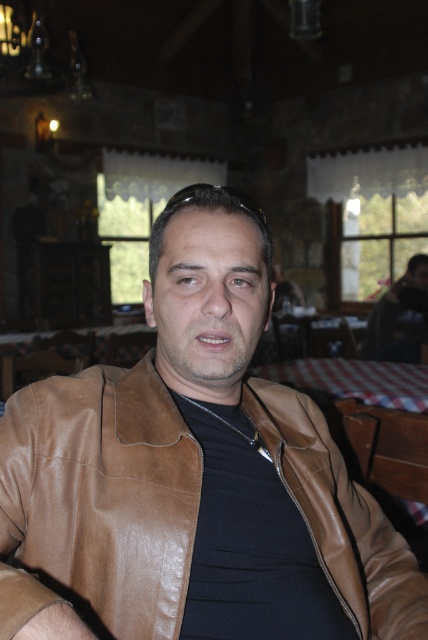
You are a tailor who needs to determine which clothing item is smaller in size between the brown leather jacket at center and the dark green shirt at right. Which one requires less fabric?

The brown leather jacket at center has a smaller size compared to the dark green shirt at right, so it requires less fabric.